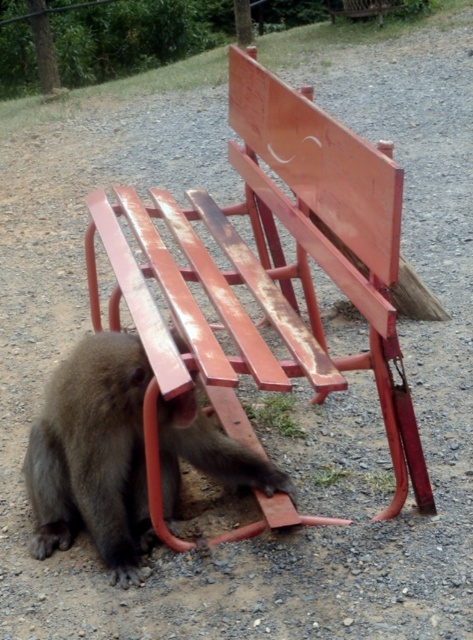
Question: Considering the relative positions of rusty wood bench at lower left and fuzzy brown monkey at lower left in the image provided, where is rusty wood bench at lower left located with respect to fuzzy brown monkey at lower left?

Choices:
 (A) right
 (B) left

Answer: (A)

Question: Is rusty wood bench at lower left bigger than fuzzy brown monkey at lower left?

Choices:
 (A) no
 (B) yes

Answer: (B)

Question: Which of the following is the closest to the observer?

Choices:
 (A) (69, 371)
 (B) (181, 550)

Answer: (B)

Question: Is rusty wood bench at lower left wider than fuzzy brown monkey at lower left?

Choices:
 (A) yes
 (B) no

Answer: (A)

Question: Which of the following is the closest to the observer?

Choices:
 (A) (272, 106)
 (B) (137, 440)

Answer: (B)